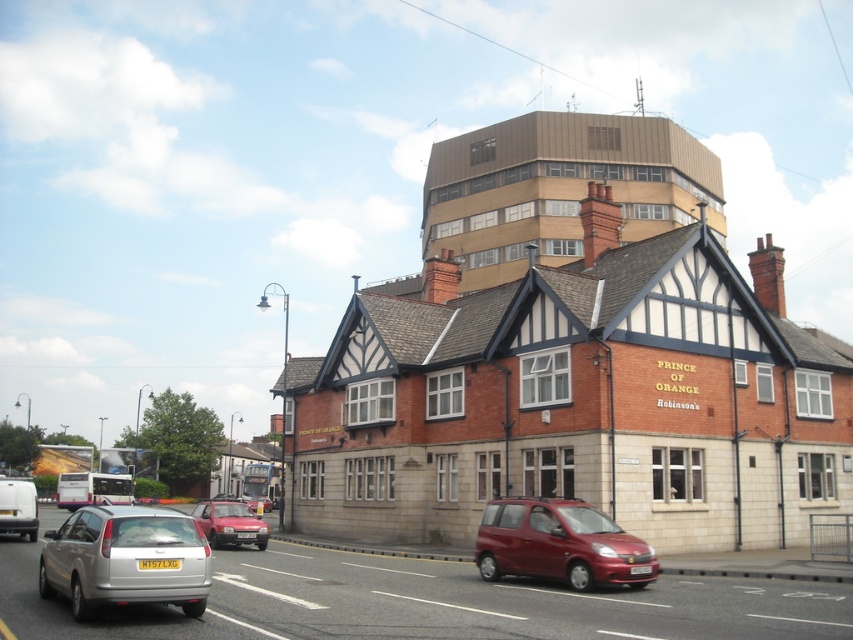
You are driving a car and want to park in the parking lot behind the traditional building with the red brick exterior. There is a silver metallic hatchback at lower left and a matte red car at center blocking your path. Which car should you move first to clear the path?

The silver metallic hatchback at lower left is closer to the viewer than the matte red car at center, so you should move the silver metallic hatchback at lower left first to clear the path.

You are a delivery driver who needs to park your vehicle in a tight space between the silver metallic hatchback at lower left and the metallic red minivan at center. Can you estimate the total length of space available between them?

The silver metallic hatchback at lower left is larger in size than metallic red minivan at center. However, without knowing the exact dimensions of each vehicle, it is impossible to determine the total length of space available between them. Please consult the parking lot layout or use a measuring tool for accurate measurements.

You are standing in the street scene and want to locate the silver metallic hatchback at lower left. Which object is closest to the point at coordinates (126, 560)?

The point at coordinates (126, 560) is on the silver metallic hatchback at lower left.